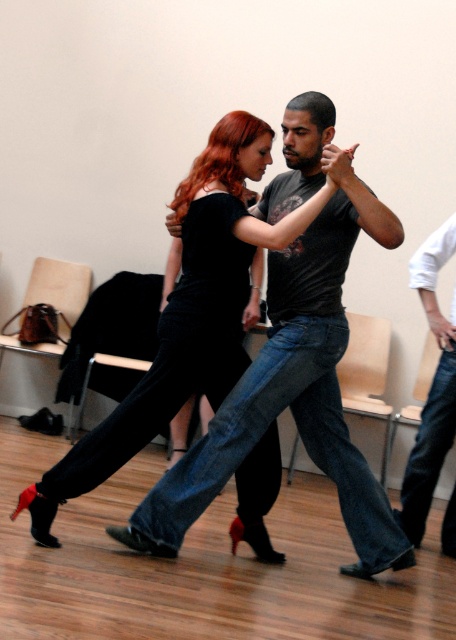
Question: Which point appears closest to the camera in this image?

Choices:
 (A) (414, 280)
 (B) (202, 374)

Answer: (B)

Question: Can you confirm if velvet black dress at center is wider than jeans at right?

Choices:
 (A) no
 (B) yes

Answer: (B)

Question: Does velvet black dress at center have a greater width compared to jeans at right?

Choices:
 (A) yes
 (B) no

Answer: (A)

Question: Among these objects, which one is nearest to the camera?

Choices:
 (A) velvet black dress at center
 (B) jeans at right

Answer: (A)

Question: Can you confirm if velvet black dress at center is thinner than jeans at right?

Choices:
 (A) no
 (B) yes

Answer: (A)